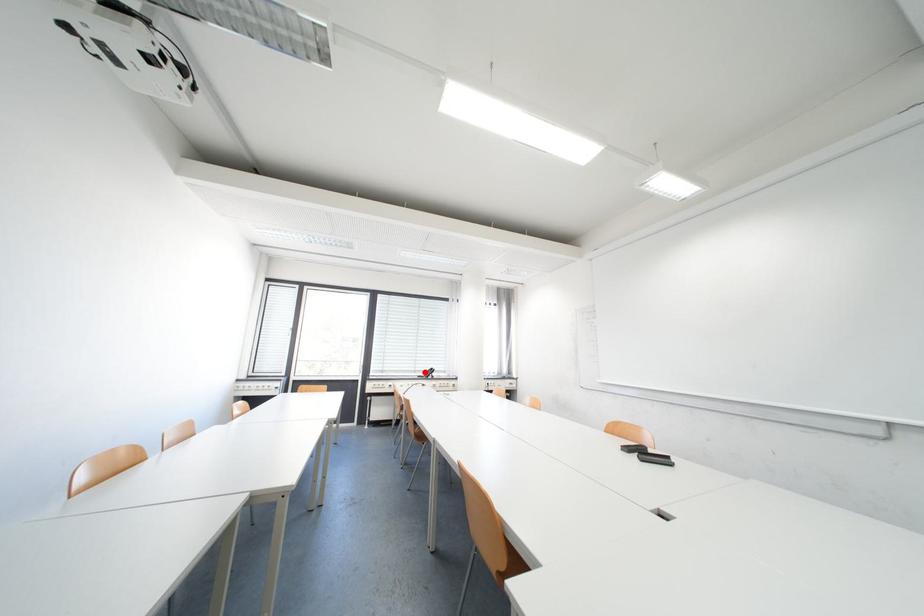
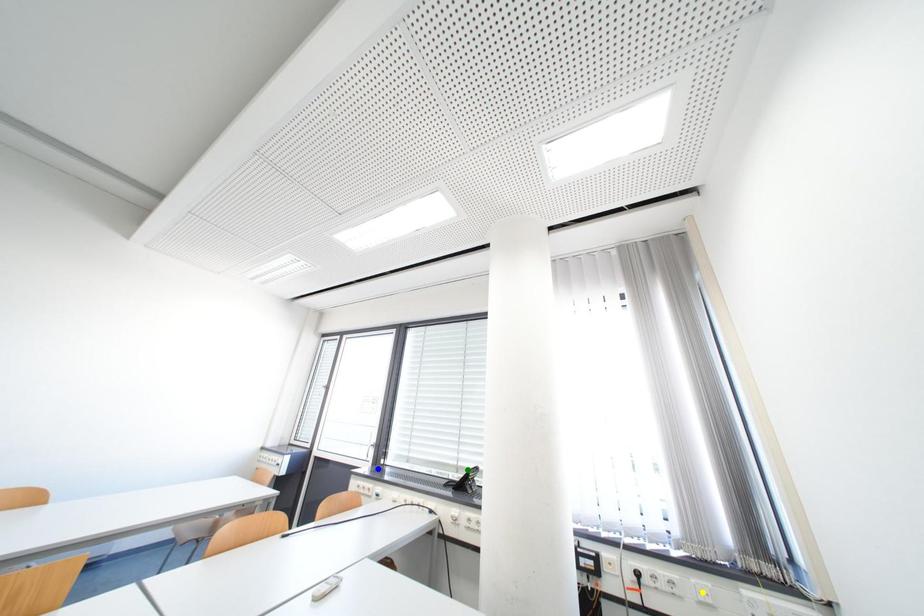
Question: I am providing you with two images of the same scene from different viewpoints. A red point is marked on the first image. You are given multiple points on the second image. Which spot in image 2 lines up with the point in image 1?

Choices:
 (A) blue point
 (B) yellow point
 (C) green point

Answer: (C)